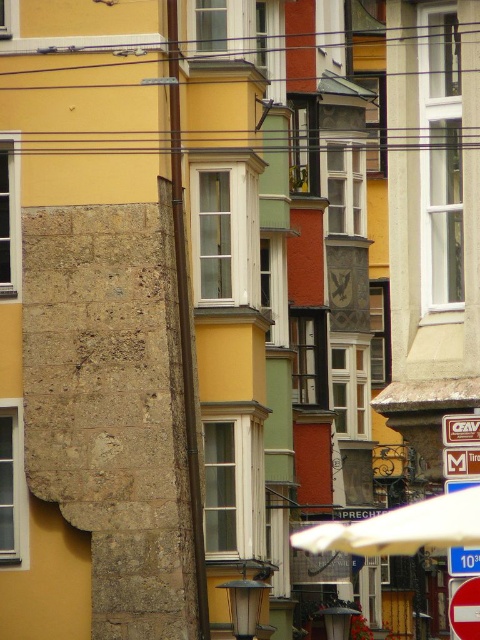
You are a photographer standing in the middle of the street, looking at the two points marked in the image. Which point, point (467, 440) or point (444, 461), is closer to your camera lens?

Point (467, 440) is closer to the camera than point (444, 461), so the photographer should focus on that point first as it is nearer.

You are standing on the European street and want to read the metallic rectangular sign at center. Considering the distance, can you read the text on the sign without moving closer?

The metallic rectangular sign at center is 226.40 feet away from the viewer. At this distance, it would be difficult to read the text clearly without moving closer.

You are a tourist in this European street scene and want to read both the metallic rectangular sign at center and the blue plastic sign at center. Which one should you look at first to the left?

The blue plastic sign at center is to the left of the metallic rectangular sign at center, so you should look at the blue plastic sign at center first.